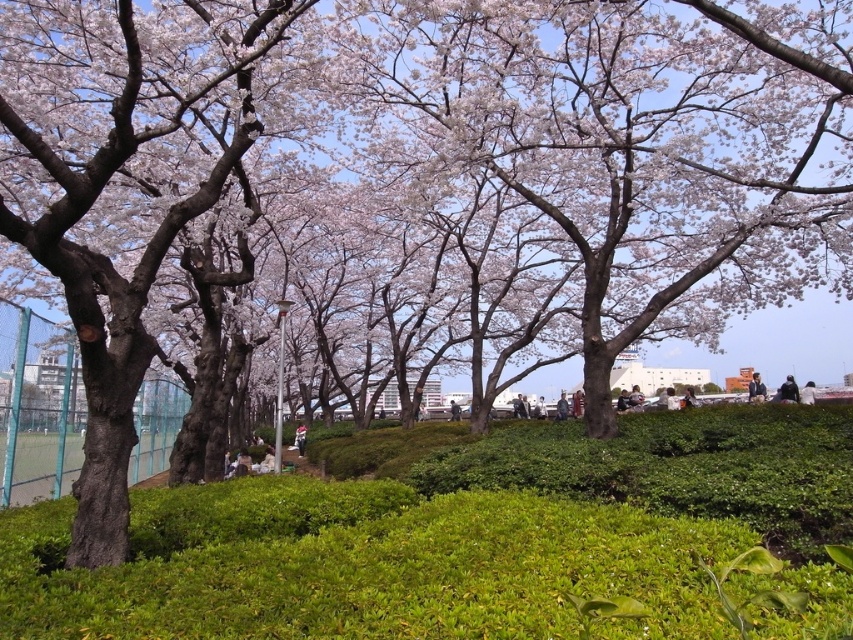
You are a fashion designer observing a springtime park scene with cherry blossoms. You notice a dark blue jacket at center and a white cotton shirt at center. Which clothing item is positioned higher in the scene?

The dark blue jacket at center is taller than the white cotton shirt at center, so it is positioned higher in the scene.

You are a park visitor holding a dark blue jacket at center. You want to place it on the ground next to the green leafy shrubs at center. Will the jacket cover more area than the shrubs?

The green leafy shrubs at center is thinner than dark blue jacket at center, so the dark blue jacket at center will cover more area than the shrubs.

You are a photographer planning to take a portrait of a person wearing both the dark blue jacket at center and the white cotton shirt at center. If you want to ensure both garments are clearly visible in the frame, which one should you focus on positioning first, considering their sizes?

The dark blue jacket at center is bigger than the white cotton shirt at center, so you should focus on positioning the dark blue jacket at center first to ensure it fits well within the frame, allowing space for the smaller white cotton shirt at center.